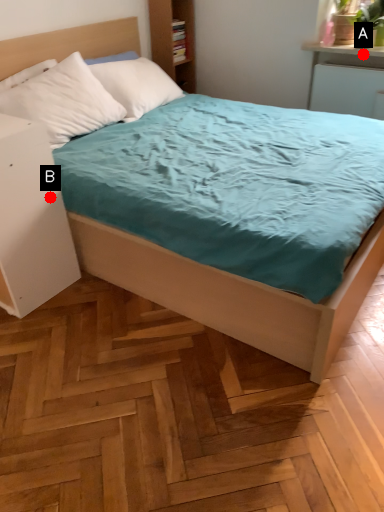
Question: Two points are circled on the image, labeled by A and B beside each circle. Among these points, which one is nearest to the camera?

Choices:
 (A) A is closer
 (B) B is closer

Answer: (B)